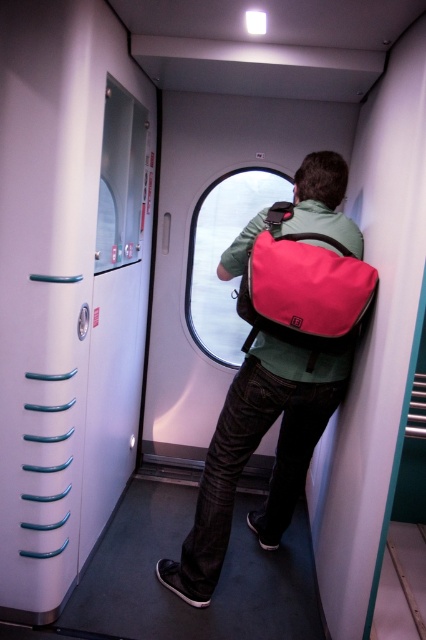
Does matte green jacket at center appear over transparent glass window at center?

Incorrect, matte green jacket at center is not positioned above transparent glass window at center.

Find the location of `matte green jacket at center`. matte green jacket at center is located at coordinates (279, 362).

Which is more to the left, matte green jacket at center or matte pink backpack at center?

matte green jacket at center

Who is more forward, (287, 378) or (313, 339)?

Point (313, 339) is in front.

This screenshot has width=426, height=640. What are the coordinates of `matte green jacket at center` in the screenshot? It's located at (279, 362).

Is white plastic door at left smaller than matte green jacket at center?

Yes, white plastic door at left is smaller than matte green jacket at center.

Does white plastic door at left appear on the left side of matte green jacket at center?

Yes, white plastic door at left is to the left of matte green jacket at center.

Who is more distant from viewer, (13, 161) or (325, 285)?

Positioned behind is point (325, 285).

Locate an element on the screen. Image resolution: width=426 pixels, height=640 pixels. white plastic door at left is located at coordinates (45, 292).